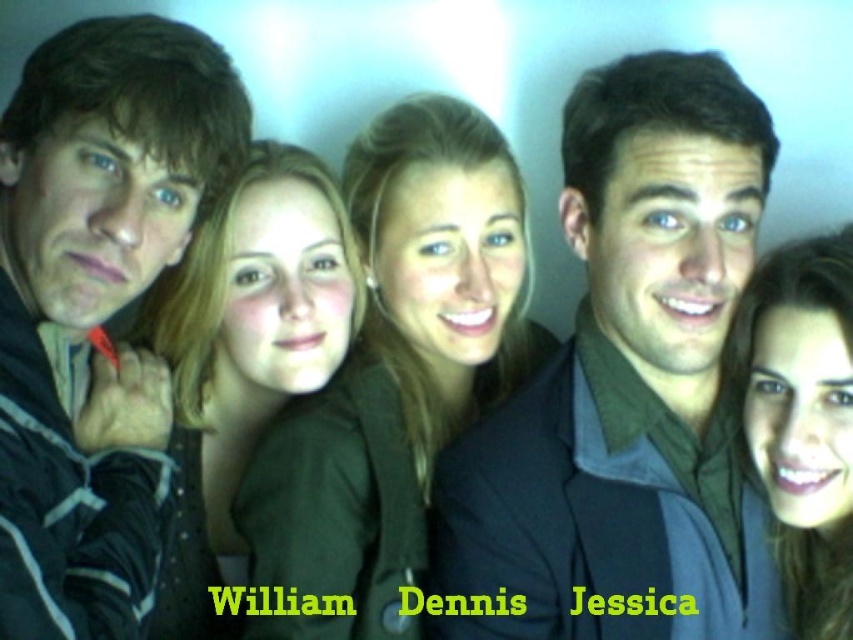
Question: In this image, where is smooth black shirt at center located relative to matte black hair at center?

Choices:
 (A) above
 (B) below

Answer: (A)

Question: Which of the following is the farthest from the observer?

Choices:
 (A) matte black hair at center
 (B) matte green shirt at left

Answer: (B)

Question: Is the position of smooth black shirt at center less distant than that of smooth black jacket at center?

Choices:
 (A) no
 (B) yes

Answer: (B)

Question: Is smooth black jacket at center in front of matte green shirt at left?

Choices:
 (A) no
 (B) yes

Answer: (B)

Question: Among these objects, which one is farthest from the camera?

Choices:
 (A) dark gray jacket at left
 (B) matte black hair at center
 (C) smooth black jacket at center
 (D) matte green shirt at left

Answer: (D)

Question: Which object is farther from the camera taking this photo?

Choices:
 (A) matte black hair at center
 (B) matte green shirt at left

Answer: (B)